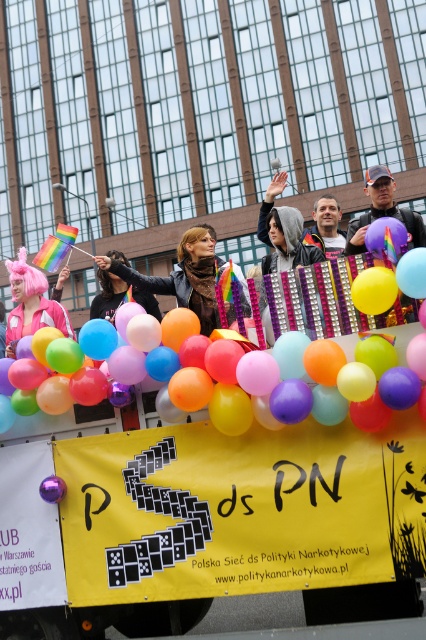
Is smooth leather jacket at center closer to camera compared to pink fabric wig at upper center?

That is True.

What do you see at coordinates (325, 227) in the screenshot? This screenshot has height=640, width=426. I see `smooth leather jacket at center` at bounding box center [325, 227].

Identify the location of smooth leather jacket at center. The image size is (426, 640). point(325,227).

Can you confirm if smooth leather jacket at center is positioned to the left of blonde synthetic wig at center?

Incorrect, smooth leather jacket at center is not on the left side of blonde synthetic wig at center.

Can you confirm if smooth leather jacket at center is bigger than blonde synthetic wig at center?

Incorrect, smooth leather jacket at center is not larger than blonde synthetic wig at center.

Between point (321, 241) and point (195, 228), which one is positioned in front?

Point (195, 228)

You are a GUI agent. You are given a task and a screenshot of the screen. Output one action in this format:
    pyautogui.click(x=<x>, y=<y>)
    Task: Click on the smooth leather jacket at center
    The height and width of the screenshot is (640, 426).
    Given the screenshot: What is the action you would take?
    pyautogui.click(x=325, y=227)

You are a GUI agent. You are given a task and a screenshot of the screen. Output one action in this format:
    pyautogui.click(x=<x>, y=<y>)
    Task: Click on the matte black jacket at center
    The height and width of the screenshot is (640, 426).
    Given the screenshot: What is the action you would take?
    point(108,296)

Is matte black jacket at center below pink fabric wig at upper center?

Yes, matte black jacket at center is below pink fabric wig at upper center.

Describe the element at coordinates (108, 296) in the screenshot. The image size is (426, 640). I see `matte black jacket at center` at that location.

At what (x,y) coordinates should I click in order to perform the action: click on matte black jacket at center. Please return your answer as a coordinate pair (x, y). This screenshot has height=640, width=426. Looking at the image, I should click on (108, 296).